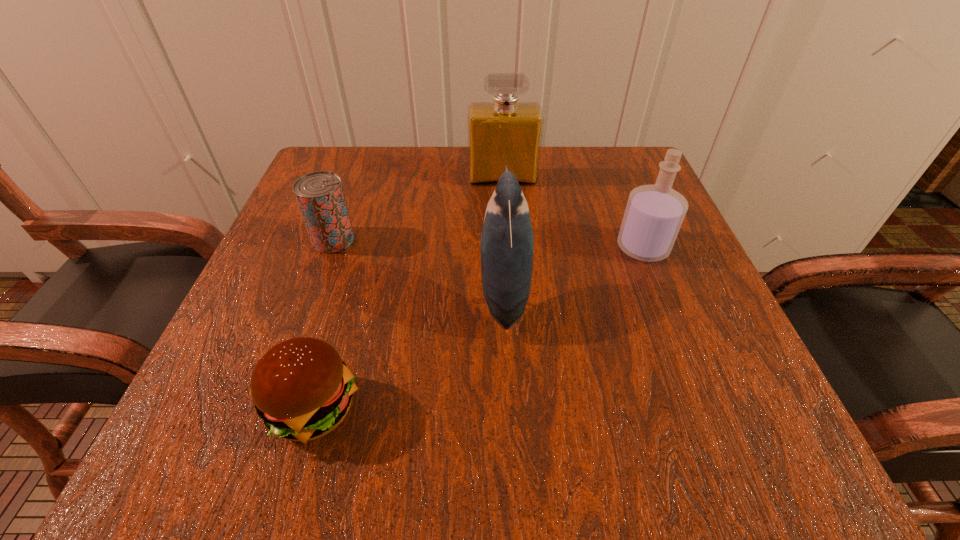
Where is `the left perfume`? The width and height of the screenshot is (960, 540). the left perfume is located at coordinates (505, 132).

This screenshot has width=960, height=540. What are the coordinates of `the farthest object` in the screenshot? It's located at (505, 132).

The width and height of the screenshot is (960, 540). In order to click on bird in this screenshot , I will do `click(507, 243)`.

Locate an element on the screen. This screenshot has height=540, width=960. the nearer perfume is located at coordinates (654, 214).

Identify the location of the right perfume. (654, 214).

This screenshot has width=960, height=540. In order to click on beer can in this screenshot , I will do `click(320, 195)`.

The image size is (960, 540). In order to click on hamburger in this screenshot , I will do `click(302, 389)`.

The width and height of the screenshot is (960, 540). Find the location of `free space located 0.230m on the front-facing side of the farthest object`. free space located 0.230m on the front-facing side of the farthest object is located at coordinates (508, 259).

Identify the location of free spot located at the tip of the bird's beak. (348, 295).

At what (x,y) coordinates should I click in order to perform the action: click on free space located at the tip of the bird's beak. Please return your answer as a coordinate pair (x, y). The image size is (960, 540). Looking at the image, I should click on (438, 295).